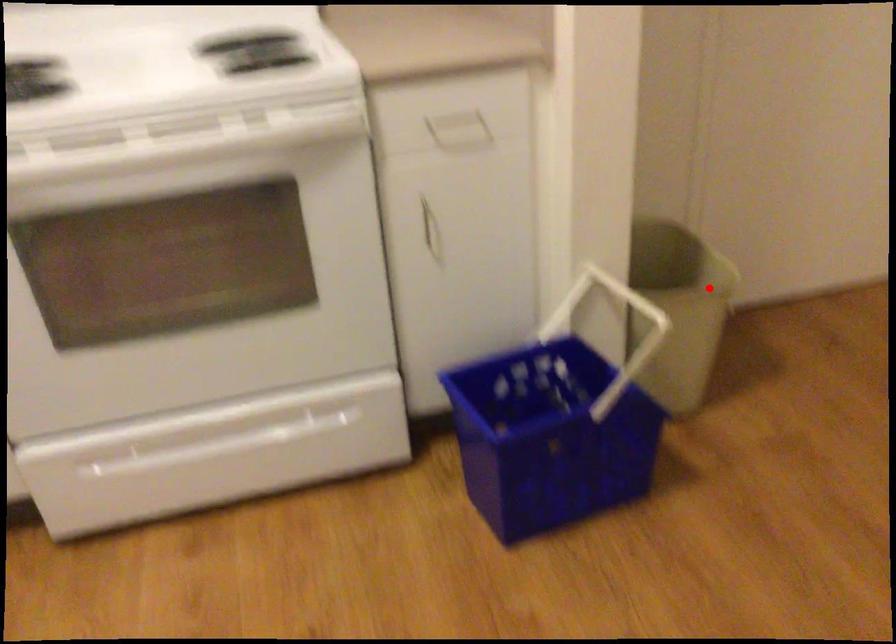
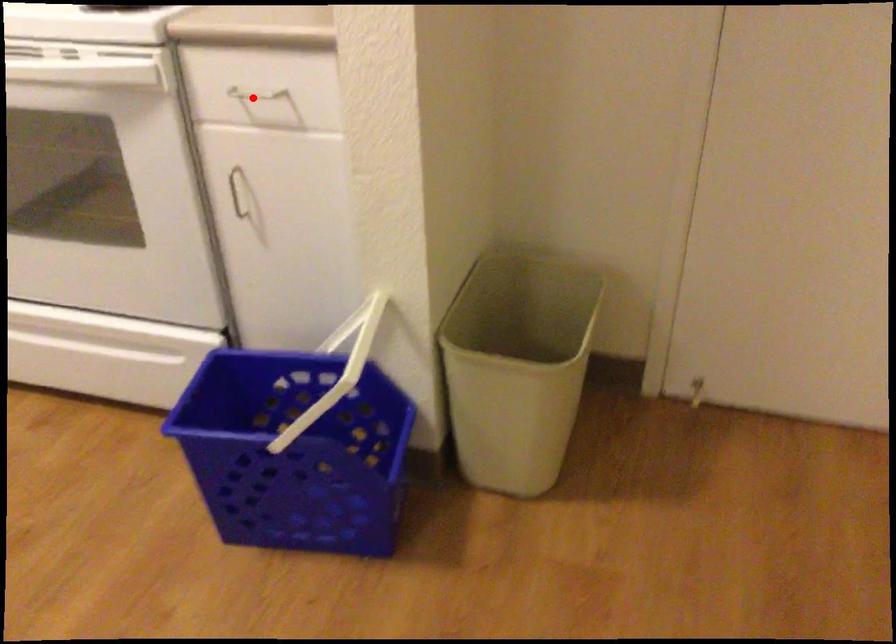
I am providing you with two images of the same scene from different viewpoints. A red point is marked on the first image and another point is marked on the second image. Is the marked point in image1 the same physical position as the marked point in image2?

No